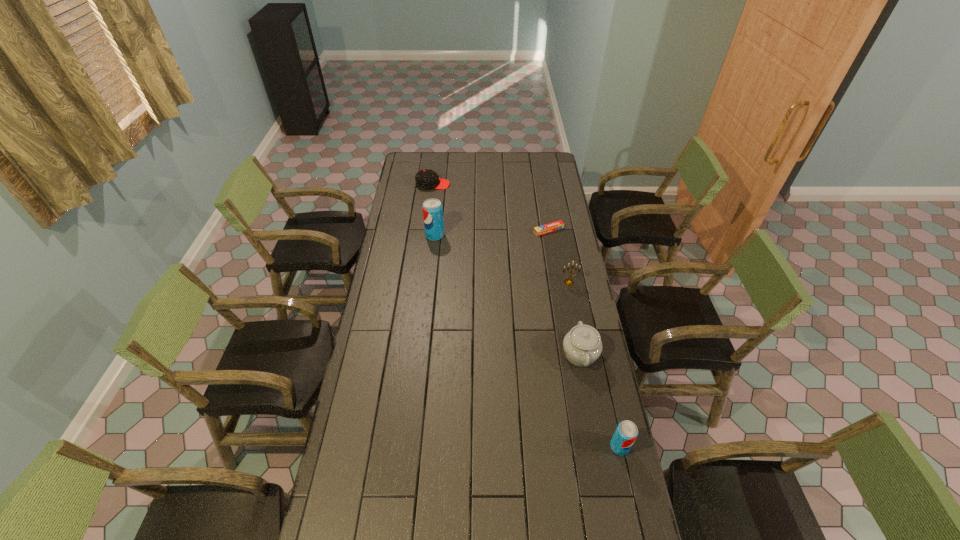
Find the location of `vacant spot for a new pop_(soda) to ensure equal spacing`. vacant spot for a new pop_(soda) to ensure equal spacing is located at coordinates (509, 320).